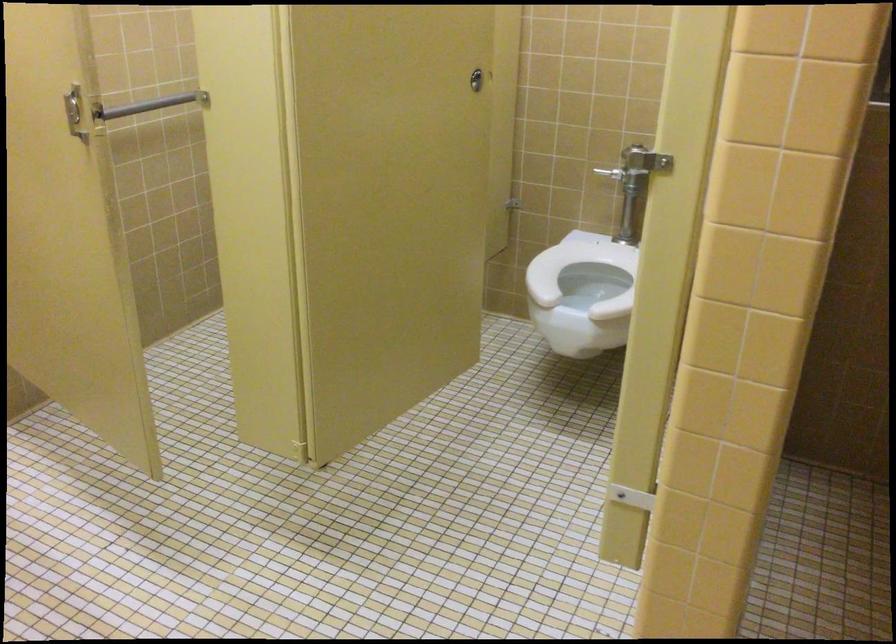
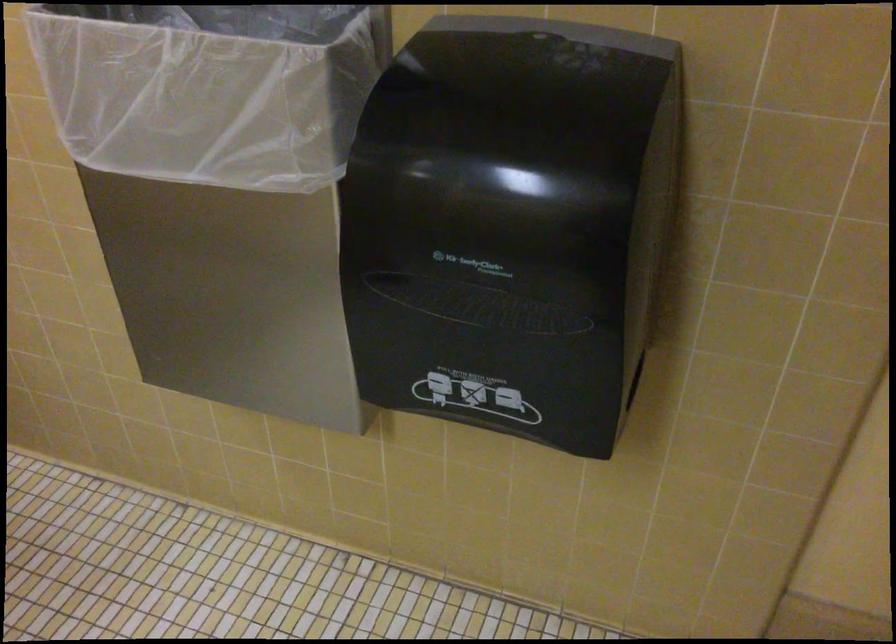
First-person continuous shooting, in which direction is the camera rotating?

The camera's rotation is toward right-down.